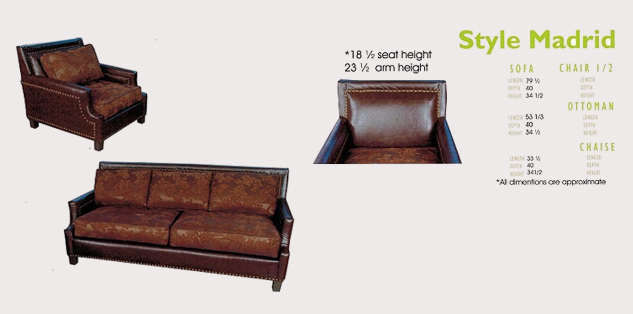
Where is `left front chair leg`? Image resolution: width=633 pixels, height=314 pixels. left front chair leg is located at coordinates (140, 119).